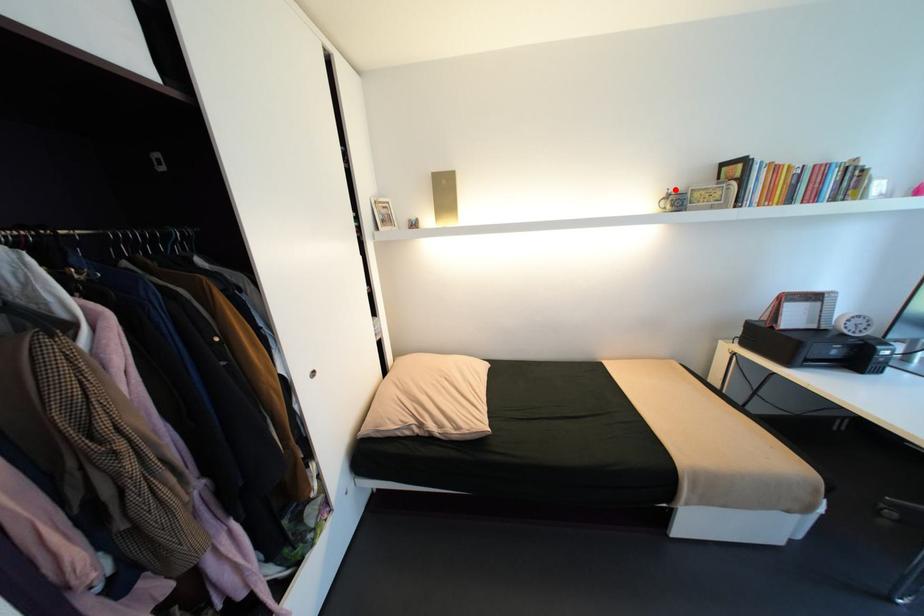
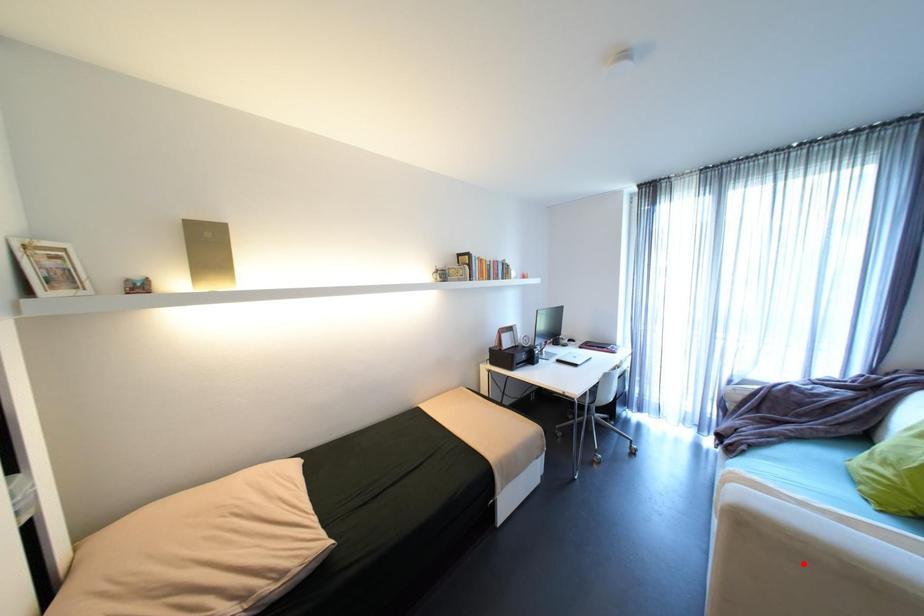
I am providing you with two images of the same scene from different viewpoints. A red point is marked on the first image and another point is marked on the second image. Are the points marked in image1 and image2 representing the same 3D position?

No